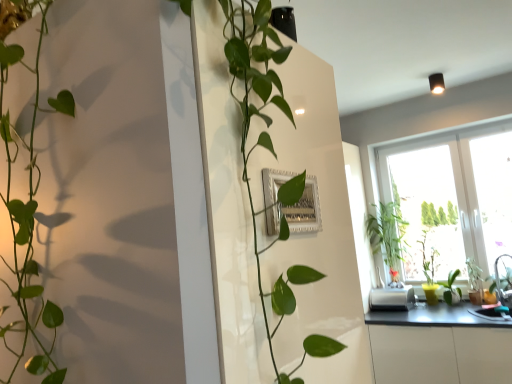
Question: Relative to green glossy plant at left, arranged as the second houseplant when viewed from the back, is metallic gray countertop at lower right in front or behind?

Choices:
 (A) behind
 (B) front

Answer: (A)

Question: Is metallic gray countertop at lower right taller or shorter than green glossy plant at left, the first houseplant from the front?

Choices:
 (A) short
 (B) tall

Answer: (A)

Question: Which object is positioned closest to the green glossy plant at right, the second houseplant viewed from the left?

Choices:
 (A) silver/glossy picture frame at center
 (B) green glossy plant at right, the 1th plant viewed from the left
 (C) metallic gray countertop at lower right
 (D) white plastic toaster at lower right
 (E) green matte plant at right, the second plant when ordered from left to right

Answer: (D)

Question: Which object is positioned farthest from the white plastic toaster at lower right?

Choices:
 (A) metallic gray countertop at lower right
 (B) green glossy plant at right, the 2th plant viewed from the right
 (C) green glossy plant at right, the second houseplant viewed from the left
 (D) green matte plant at right, the second plant when ordered from left to right
 (E) silver/glossy picture frame at center

Answer: (E)